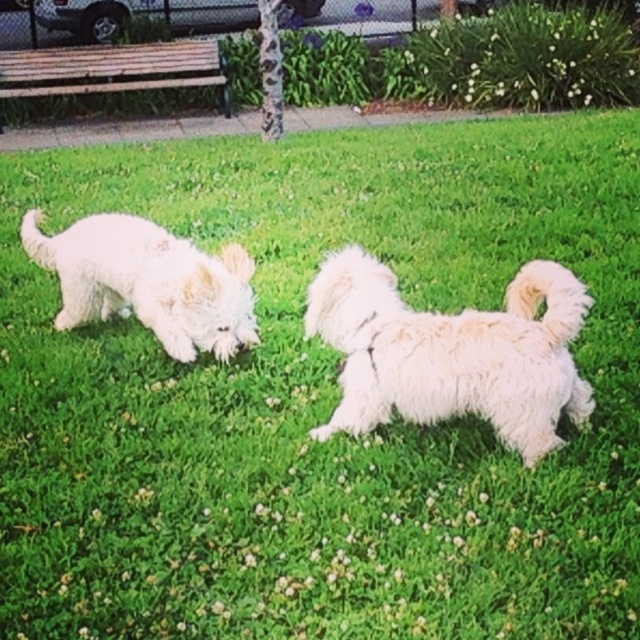
You are a photographer trying to capture both dogs in a single frame. Given that your camera can only focus on objects wider than 20 cm, can both the white fluffy dog at center and the white fluffy dog at left be in focus?

The white fluffy dog at center has a width less than the white fluffy dog at left. Since the camera requires objects wider than 20 cm to focus, we need to know the exact width of the wider dog. However, without specific measurements, we cannot confirm if both meet the requirement. Please provide more details.

You are a photographer trying to capture the white fluffy dog at center in your shot. You need to adjust your camera to focus precisely at the coordinates provided in the scene description. What coordinates should you set your camera to?

The white fluffy dog at center is positioned at point (x=451, y=353), so you should set your camera to focus at those coordinates.

You are a dog trainer observing two dogs at a park. The dogs are at point (385,346). You need to place a treat between them so both can reach it easily. What is the minimum distance the treat should be from each dog to ensure fairness?

The minimum distance the treat should be from each dog to ensure fairness is half of the distance between them, which is 4.795 feet.